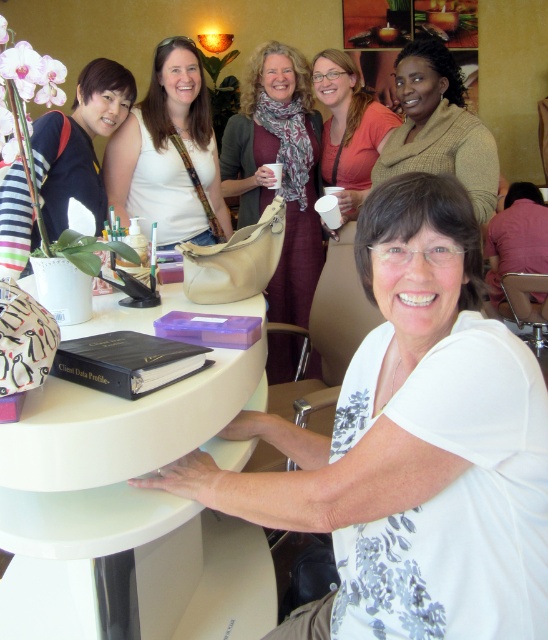
Based on the photo, you are a barista preparing a drink and need to place a matte white mug at upper center on the table. There is already a matte white purse at upper center there. Is there enough space between them to place the mug without moving the purse?

The distance between the matte white purse at upper center and the matte white mug at upper center is 23.73 inches, so there is sufficient space to place the mug without moving the purse.

What is located at the point with coordinates (282,170)?

The point at coordinates (282,170) has a matte brown scarf at center.

You are standing in the center of the room and want to place a decorative vase on the white glossy round table at center. Given that the table is positioned at coordinates 0.781 on the x and 0.241 on the y axis, can you determine its exact location relative to the room?

The white glossy round table at center is located at point 0.781 on the x axis and 0.241 on the y axis, so it is positioned slightly to the right and lower part of the room based on the coordinate system provided.